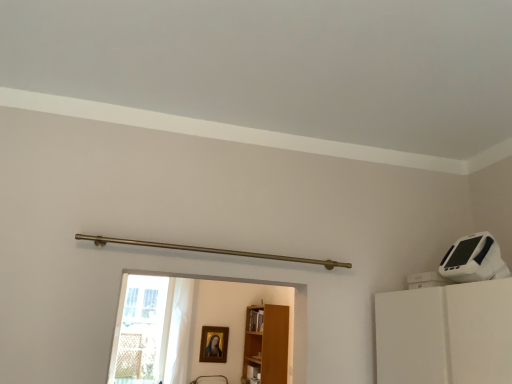
Question: Considering the relative sizes of transparent glass door at lower left and gold-framed portrait at center in the image provided, is transparent glass door at lower left wider than gold-framed portrait at center?

Choices:
 (A) yes
 (B) no

Answer: (B)

Question: Are transparent glass door at lower left and gold-framed portrait at center far apart?

Choices:
 (A) yes
 (B) no

Answer: (B)

Question: Could you tell me if transparent glass door at lower left is facing gold-framed portrait at center?

Choices:
 (A) yes
 (B) no

Answer: (B)

Question: Is transparent glass door at lower left at the left side of gold-framed portrait at center?

Choices:
 (A) yes
 (B) no

Answer: (A)

Question: Is transparent glass door at lower left oriented away from gold-framed portrait at center?

Choices:
 (A) no
 (B) yes

Answer: (A)

Question: Considering the positions of point [x=272, y=332] and point [x=157, y=321], is point [x=272, y=332] closer or farther from the camera than point [x=157, y=321]?

Choices:
 (A) farther
 (B) closer

Answer: (A)

Question: Looking at their shapes, would you say light brown wood bookshelf at center is wider or thinner than transparent glass door at lower left?

Choices:
 (A) thin
 (B) wide

Answer: (B)

Question: Based on their positions, is light brown wood bookshelf at center located to the left or right of transparent glass door at lower left?

Choices:
 (A) left
 (B) right

Answer: (B)

Question: From a real-world perspective, is light brown wood bookshelf at center positioned above or below transparent glass door at lower left?

Choices:
 (A) below
 (B) above

Answer: (A)

Question: Is point (206, 344) closer or farther from the camera than point (142, 301)?

Choices:
 (A) farther
 (B) closer

Answer: (A)

Question: Is gold-framed portrait at center wider or thinner than transparent glass door at lower left?

Choices:
 (A) thin
 (B) wide

Answer: (B)

Question: From a real-world perspective, relative to transparent glass door at lower left, is gold-framed portrait at center vertically above or below?

Choices:
 (A) above
 (B) below

Answer: (B)

Question: Which is correct: gold-framed portrait at center is inside transparent glass door at lower left, or outside of it?

Choices:
 (A) outside
 (B) inside

Answer: (A)

Question: In terms of height, does light brown wood bookshelf at center look taller or shorter compared to gold-framed portrait at center?

Choices:
 (A) short
 (B) tall

Answer: (B)

Question: From the image's perspective, relative to gold-framed portrait at center, is light brown wood bookshelf at center above or below?

Choices:
 (A) above
 (B) below

Answer: (A)